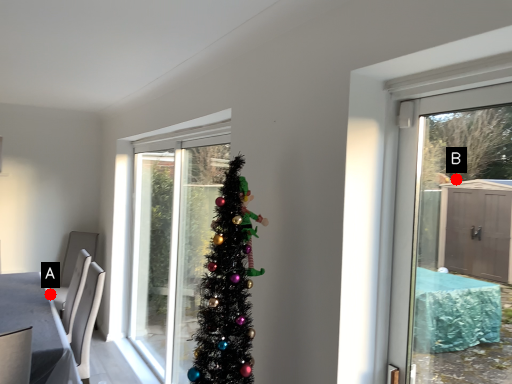
Question: Two points are circled on the image, labeled by A and B beside each circle. Among these points, which one is farthest from the camera?

Choices:
 (A) A is further
 (B) B is further

Answer: (A)